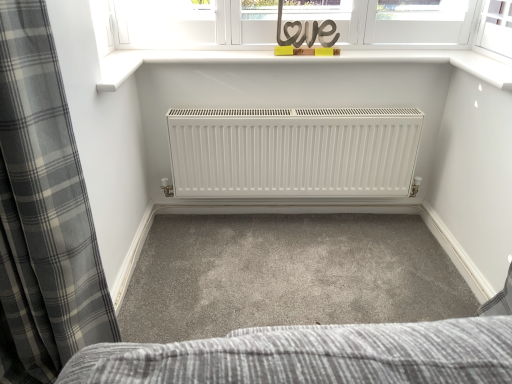
Question: In the image, is gray plaid curtain at left positioned in front of or behind wooden love sign at upper center?

Choices:
 (A) front
 (B) behind

Answer: (A)

Question: Based on their sizes in the image, would you say gray plaid curtain at left is bigger or smaller than wooden love sign at upper center?

Choices:
 (A) big
 (B) small

Answer: (A)

Question: Do you think gray plaid curtain at left is within wooden love sign at upper center, or outside of it?

Choices:
 (A) inside
 (B) outside

Answer: (B)

Question: Looking at their shapes, would you say wooden love sign at upper center is wider or thinner than gray plaid curtain at left?

Choices:
 (A) thin
 (B) wide

Answer: (A)

Question: In terms of height, does wooden love sign at upper center look taller or shorter compared to gray plaid curtain at left?

Choices:
 (A) tall
 (B) short

Answer: (B)

Question: Choose the correct answer: Is wooden love sign at upper center inside gray plaid curtain at left or outside it?

Choices:
 (A) inside
 (B) outside

Answer: (B)

Question: Does point (276, 39) appear closer or farther from the camera than point (55, 54)?

Choices:
 (A) farther
 (B) closer

Answer: (A)